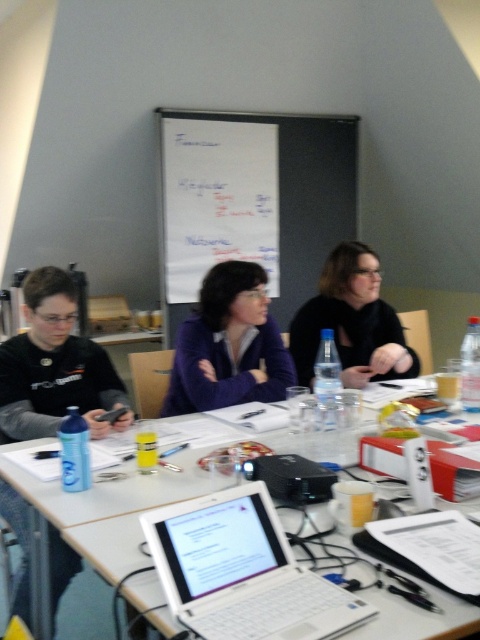
Can you confirm if purple sweater at center is shorter than white plastic table at center?

No.

Is purple sweater at center behind white plastic table at center?

Yes, it is.

Identify the location of purple sweater at center. Image resolution: width=480 pixels, height=640 pixels. pos(228,346).

Can you confirm if matte black shirt at left is thinner than purple sweater at center?

Indeed, matte black shirt at left has a lesser width compared to purple sweater at center.

Is point (16, 609) positioned after point (268, 362)?

No, it is not.

Where is `matte black shirt at left`? This screenshot has width=480, height=640. matte black shirt at left is located at coordinates (55, 365).

Consider the image. Which is more to the right, white plastic laptop at center or purple sweater at center?

white plastic laptop at center is more to the right.

Is white plastic laptop at center taller than purple sweater at center?

In fact, white plastic laptop at center may be shorter than purple sweater at center.

Who is more distant from viewer, (266, 544) or (259, 326)?

The point (259, 326) is more distant.

Locate an element on the screen. white plastic laptop at center is located at coordinates (242, 572).